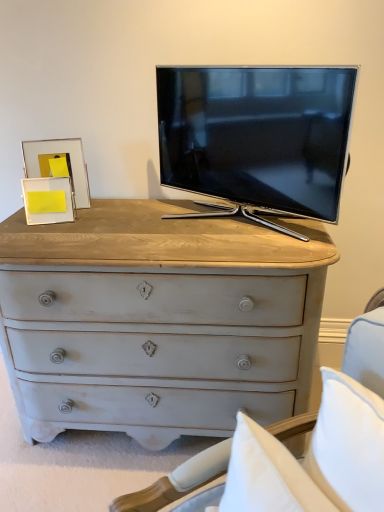
Question: From their relative heights in the image, would you say yellow paper at left, which ranks as the 1th picture frame in front-to-back order, is taller or shorter than matte black tv at center?

Choices:
 (A) short
 (B) tall

Answer: (A)

Question: In the image, is yellow paper at left, which ranks as the 1th picture frame in front-to-back order, positioned in front of or behind matte black tv at center?

Choices:
 (A) behind
 (B) front

Answer: (A)

Question: Which is nearer to the gold metallic picture frame at upper left, arranged as the second picture frame when viewed from the front?

Choices:
 (A) yellow paper at left, the second picture frame viewed from the back
 (B) matte black tv at center
 (C) distressed white chest of drawers at center

Answer: (A)

Question: Estimate the real-world distances between objects in this image. Which object is farther from the yellow paper at left, which ranks as the 1th picture frame in front-to-back order?

Choices:
 (A) matte black tv at center
 (B) gold metallic picture frame at upper left, arranged as the second picture frame when viewed from the front
 (C) distressed white chest of drawers at center

Answer: (A)